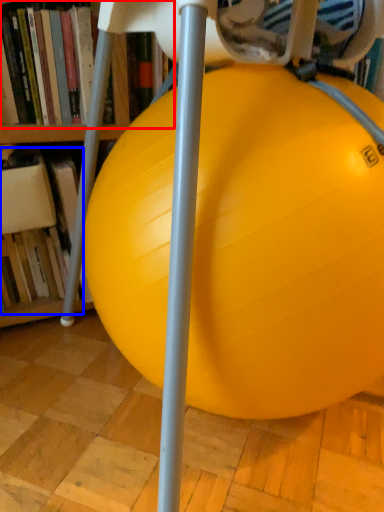
Question: Which object appears closest to the camera in this image, book (highlighted by a red box) or book (highlighted by a blue box)?

Choices:
 (A) book
 (B) book

Answer: (A)